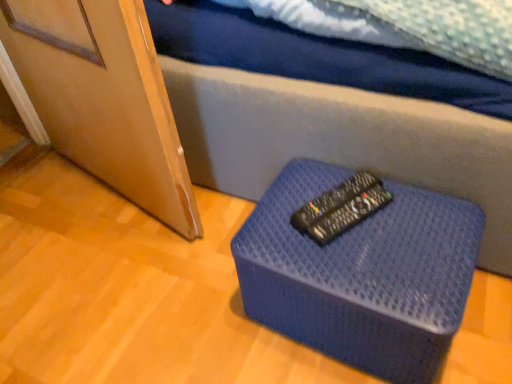
Question: From the image's perspective, is blue textured ottoman at center positioned above or below black plastic remote at center?

Choices:
 (A) above
 (B) below

Answer: (B)

Question: Considering the positions of blue textured ottoman at center and black plastic remote at center in the image, is blue textured ottoman at center wider or thinner than black plastic remote at center?

Choices:
 (A) wide
 (B) thin

Answer: (A)

Question: Is blue textured ottoman at center bigger or smaller than black plastic remote at center?

Choices:
 (A) big
 (B) small

Answer: (A)

Question: Looking at the image, does black plastic remote at center seem bigger or smaller compared to blue textured ottoman at center?

Choices:
 (A) big
 (B) small

Answer: (B)

Question: Is black plastic remote at center to the left or to the right of blue textured ottoman at center in the image?

Choices:
 (A) left
 (B) right

Answer: (A)

Question: Considering their positions, is black plastic remote at center located in front of or behind blue textured ottoman at center?

Choices:
 (A) front
 (B) behind

Answer: (B)

Question: Is black plastic remote at center situated inside blue textured ottoman at center or outside?

Choices:
 (A) outside
 (B) inside

Answer: (A)